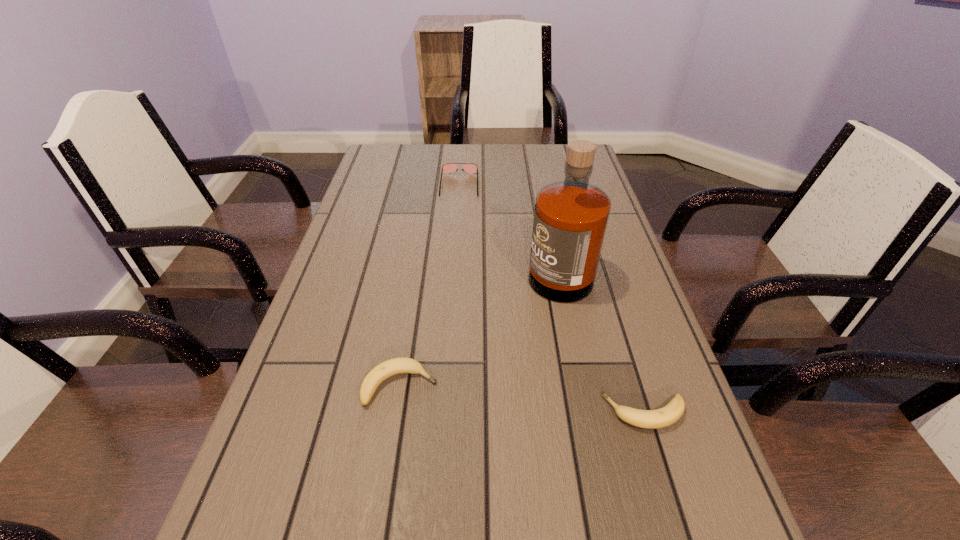
Locate an element on the screen. Image resolution: width=960 pixels, height=540 pixels. vacant region at the right edge of the desktop is located at coordinates (596, 294).

The height and width of the screenshot is (540, 960). Identify the location of free space at the far left corner. (408, 170).

The image size is (960, 540). What are the coordinates of `free space that is in between the liquor and the third shortest object` in the screenshot? It's located at (509, 225).

This screenshot has width=960, height=540. Identify the location of free space between the third nearest object and the right banana. (601, 339).

Identify the location of free space between the right banana and the liquor. (601, 339).

What are the coordinates of `free space between the liquor and the third shortest object` in the screenshot? It's located at (509, 225).

The width and height of the screenshot is (960, 540). In order to click on vacant area that lies between the tallest object and the sunglasses in this screenshot , I will do `click(509, 225)`.

You are a GUI agent. You are given a task and a screenshot of the screen. Output one action in this format:
    pyautogui.click(x=<x>, y=<y>)
    Task: Click on the free spot between the left banana and the second tallest object
    
    Given the screenshot: What is the action you would take?
    pyautogui.click(x=430, y=285)

Where is `empty location between the left banana and the liquor`? empty location between the left banana and the liquor is located at coordinates pos(479,325).

The height and width of the screenshot is (540, 960). I want to click on object that is the closest one to the sunglasses, so click(570, 221).